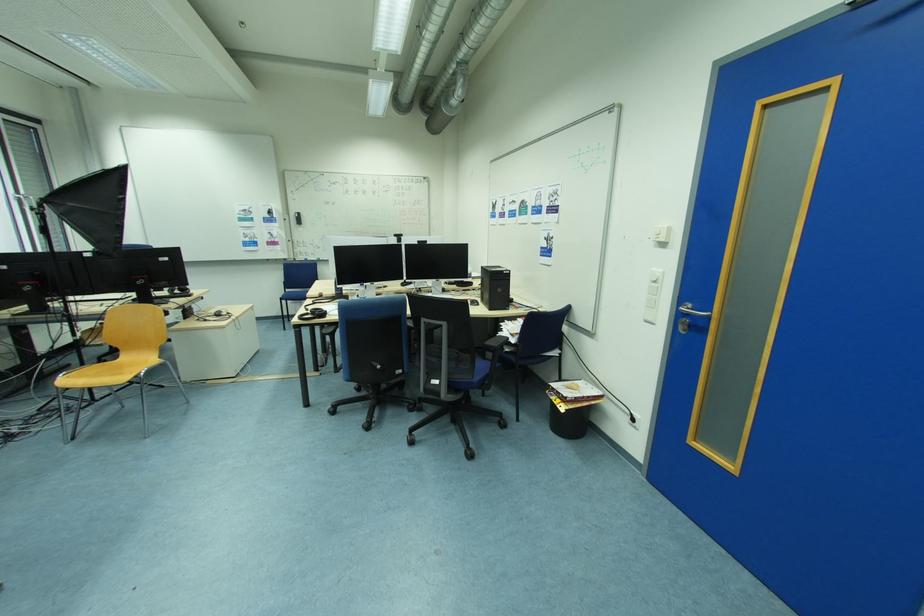
Find the location of a particular element. Image resolution: width=924 pixels, height=616 pixels. silver door handle is located at coordinates click(688, 315).